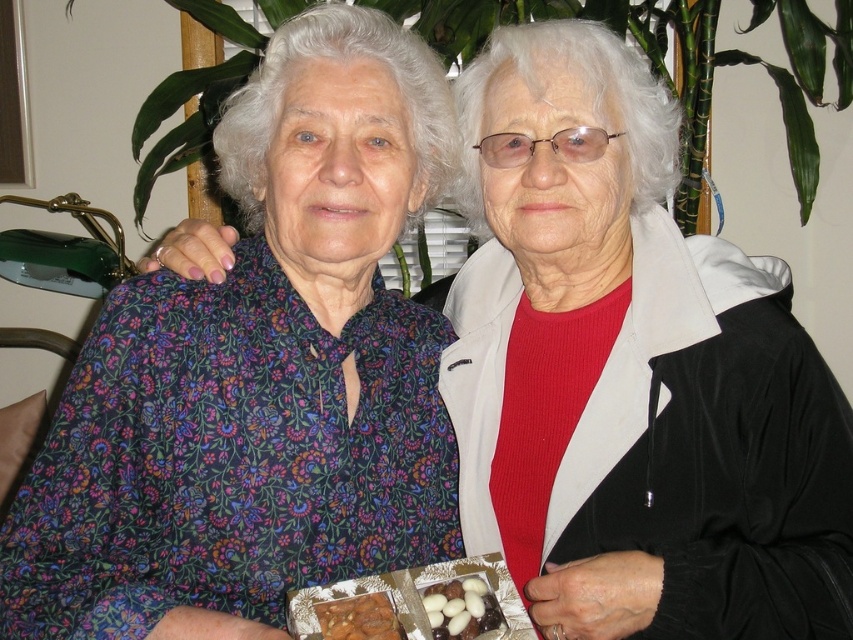
Question: Is white glossy candy at lower center thinner than chocolate-coated nuts at lower center?

Choices:
 (A) yes
 (B) no

Answer: (A)

Question: Which is nearer to the matte black jacket at right?

Choices:
 (A) floral fabric blouse at left
 (B) white glossy candy at lower center
 (C) chocolate-coated nuts at lower center

Answer: (A)

Question: Is matte black jacket at right smaller than chocolate-coated nuts at lower center?

Choices:
 (A) yes
 (B) no

Answer: (B)

Question: Estimate the real-world distances between objects in this image. Which object is farther from the floral fabric blouse at left?

Choices:
 (A) chocolate-coated nuts at lower center
 (B) matte black jacket at right

Answer: (A)

Question: Is matte black jacket at right wider than chocolate-coated nuts at lower center?

Choices:
 (A) yes
 (B) no

Answer: (A)

Question: Which point is closer to the camera?

Choices:
 (A) matte black jacket at right
 (B) chocolate-coated nuts at lower center
 (C) white glossy candy at lower center

Answer: (B)